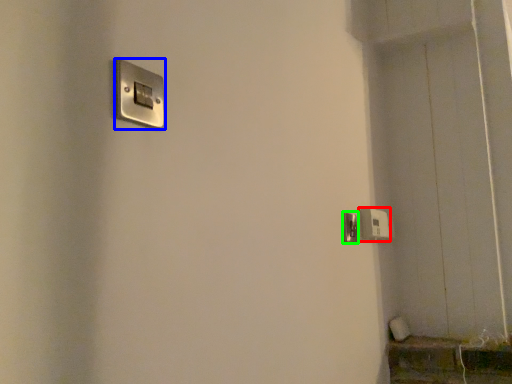
Question: Considering the real-world distances, which object is closest to light switch (highlighted by a red box)? light switch (highlighted by a blue box) or door handle (highlighted by a green box).

Choices:
 (A) light switch
 (B) door handle

Answer: (B)